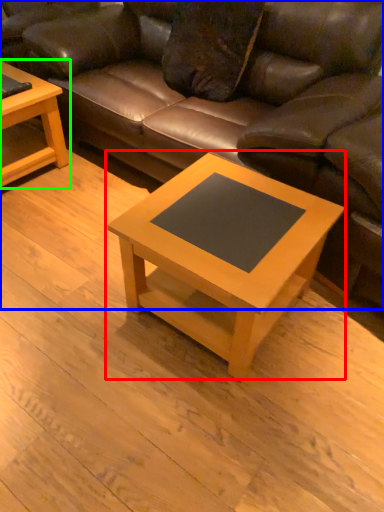
Question: Based on their relative distances, which object is nearer to coffee table (highlighted by a red box)? Choose from studio couch (highlighted by a blue box) and coffee table (highlighted by a green box).

Choices:
 (A) studio couch
 (B) coffee table

Answer: (A)